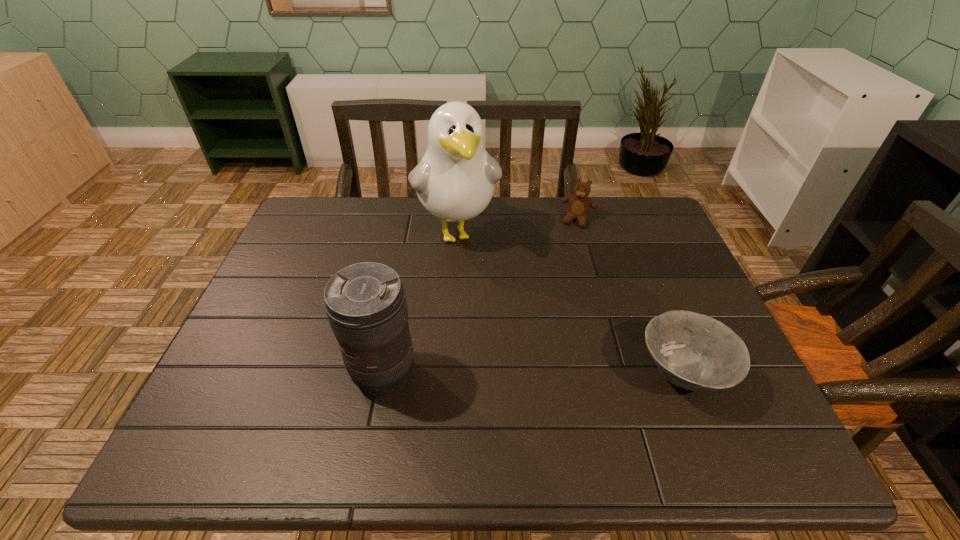
Identify the location of the second tallest object. (365, 303).

Identify the location of bowl. The width and height of the screenshot is (960, 540). (693, 351).

You are a GUI agent. You are given a task and a screenshot of the screen. Output one action in this format:
    pyautogui.click(x=<x>, y=<y>)
    Task: Click on the second shortest object
    The width and height of the screenshot is (960, 540).
    Given the screenshot: What is the action you would take?
    pyautogui.click(x=579, y=205)

In order to click on the tallest object in this screenshot , I will do (455, 180).

Find the location of a particular element. The width and height of the screenshot is (960, 540). free point located on the back of the bowl is located at coordinates (648, 290).

Where is `free point located at the face of the teddy bear`? This screenshot has height=540, width=960. free point located at the face of the teddy bear is located at coordinates (540, 320).

Locate an element on the screen. The height and width of the screenshot is (540, 960). free space located 0.320m at the face of the teddy bear is located at coordinates (548, 301).

Where is `vacant space located at the face of the teddy bear`? The image size is (960, 540). vacant space located at the face of the teddy bear is located at coordinates (571, 239).

At what (x,y) coordinates should I click in order to perform the action: click on free space located 0.200m on the beak of the gull. Please return your answer as a coordinate pair (x, y). Looking at the image, I should click on (482, 319).

The image size is (960, 540). Find the location of `free point located on the beak of the gull`. free point located on the beak of the gull is located at coordinates (498, 374).